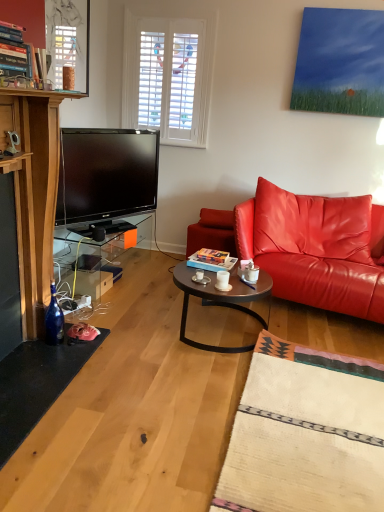
Question: Is white ceramic mug at center further to camera compared to transparent glass table at lower left?

Choices:
 (A) yes
 (B) no

Answer: (B)

Question: Are white ceramic mug at center and transparent glass table at lower left located far from each other?

Choices:
 (A) yes
 (B) no

Answer: (A)

Question: Is white ceramic mug at center with transparent glass table at lower left?

Choices:
 (A) no
 (B) yes

Answer: (A)

Question: Can you confirm if white ceramic mug at center is wider than transparent glass table at lower left?

Choices:
 (A) yes
 (B) no

Answer: (B)

Question: Is white ceramic mug at center positioned with its back to transparent glass table at lower left?

Choices:
 (A) no
 (B) yes

Answer: (B)

Question: Considering their positions, is white ceramic mug at center located in front of or behind transparent glass table at lower left?

Choices:
 (A) front
 (B) behind

Answer: (A)

Question: Considering the relative positions of white ceramic mug at center and transparent glass table at lower left in the image provided, is white ceramic mug at center to the left or to the right of transparent glass table at lower left?

Choices:
 (A) left
 (B) right

Answer: (B)

Question: From a real-world perspective, is white ceramic mug at center positioned above or below transparent glass table at lower left?

Choices:
 (A) below
 (B) above

Answer: (B)

Question: From the image's perspective, is white ceramic mug at center located above or below transparent glass table at lower left?

Choices:
 (A) above
 (B) below

Answer: (B)

Question: Looking at their shapes, would you say blue glass bottle at lower left is wider or thinner than white ceramic mug at center?

Choices:
 (A) thin
 (B) wide

Answer: (B)

Question: In terms of height, does blue glass bottle at lower left look taller or shorter compared to white ceramic mug at center?

Choices:
 (A) tall
 (B) short

Answer: (A)

Question: From a real-world perspective, relative to white ceramic mug at center, is blue glass bottle at lower left vertically above or below?

Choices:
 (A) above
 (B) below

Answer: (B)

Question: Would you say blue glass bottle at lower left is to the left or to the right of white ceramic mug at center in the picture?

Choices:
 (A) left
 (B) right

Answer: (A)

Question: Based on their positions, is shiny leather couch at right located to the left or right of white ceramic mug at center?

Choices:
 (A) right
 (B) left

Answer: (A)

Question: Is shiny leather couch at right situated inside white ceramic mug at center or outside?

Choices:
 (A) inside
 (B) outside

Answer: (B)